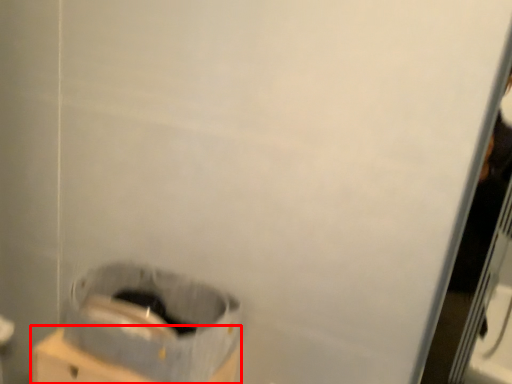
Question: From the image's perspective, what is the correct spatial positioning of cardboard box (annotated by the red box) in reference to waste container?

Choices:
 (A) above
 (B) below

Answer: (B)